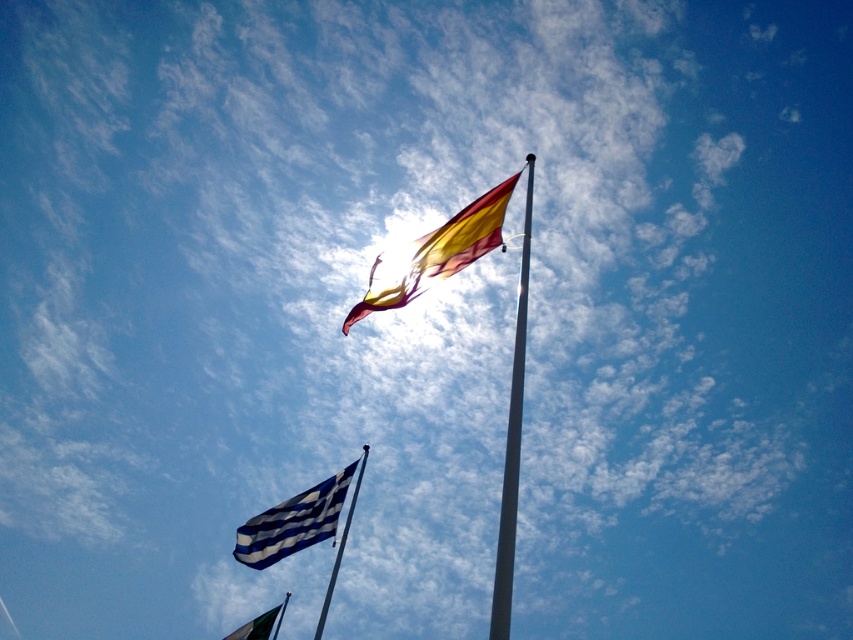
Question: Which point is closer to the camera taking this photo?

Choices:
 (A) (340, 548)
 (B) (238, 630)
 (C) (318, 630)
 (D) (514, 417)

Answer: (D)

Question: Which point is farther to the camera?

Choices:
 (A) smooth metal pole at center
 (B) yellow-red fabric flag at center
 (C) green fabric flag at lower left
 (D) blue/white striped flag at lower left

Answer: (C)

Question: Is yellow-red fabric flag at center thinner than smooth metal pole at center?

Choices:
 (A) yes
 (B) no

Answer: (B)

Question: Is smooth metal pole at center to the left of silver metallic flag pole at lower center from the viewer's perspective?

Choices:
 (A) yes
 (B) no

Answer: (B)

Question: Can you confirm if yellow-red fabric flag at center is smaller than blue/white striped flag at lower left?

Choices:
 (A) no
 (B) yes

Answer: (B)

Question: Among these points, which one is farthest from the camera?

Choices:
 (A) (229, 637)
 (B) (338, 552)
 (C) (503, 497)
 (D) (413, 266)

Answer: (A)